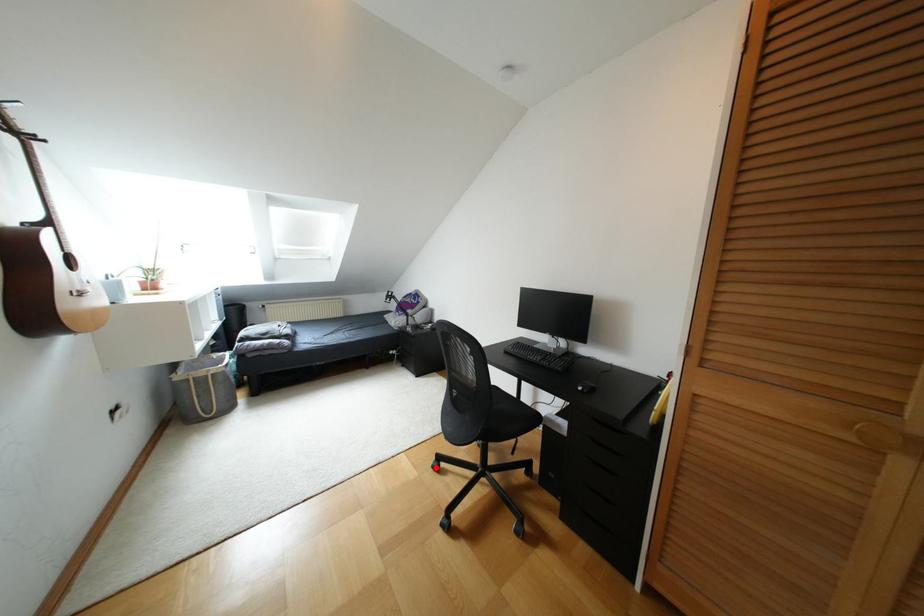
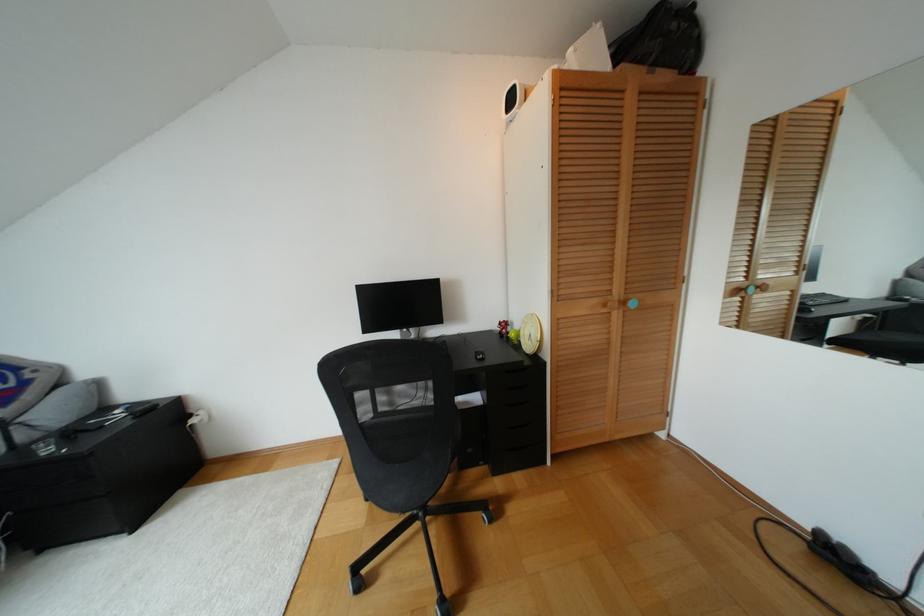
Question: I am providing you with two images of the same scene from different viewpoints. Image1 has a red point marked. In image2, the corresponding 3D location appears at what relative position? Reply with the corresponding letter.

Choices:
 (A) Closer
 (B) Farther

Answer: (A)